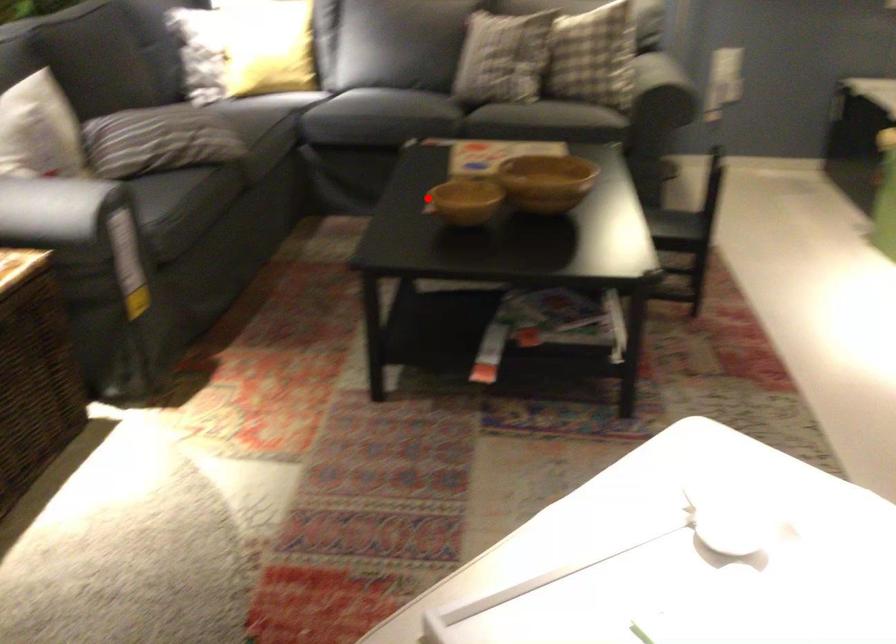
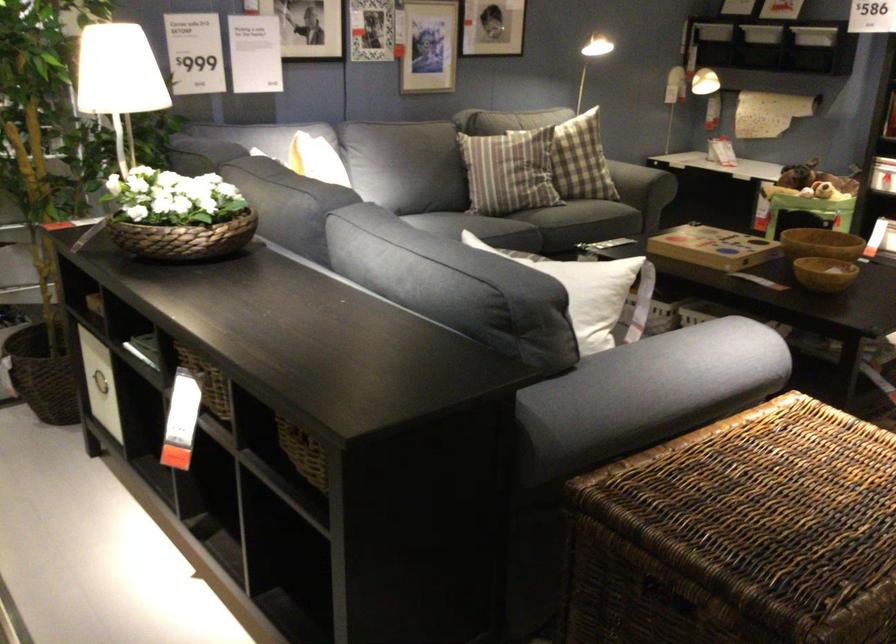
Question: I am providing you with two images of the same scene from different viewpoints. In image1, a red point is highlighted. Considering the same 3D point in image2, which of the following is correct?

Choices:
 (A) It is closer
 (B) It is farther

Answer: (B)